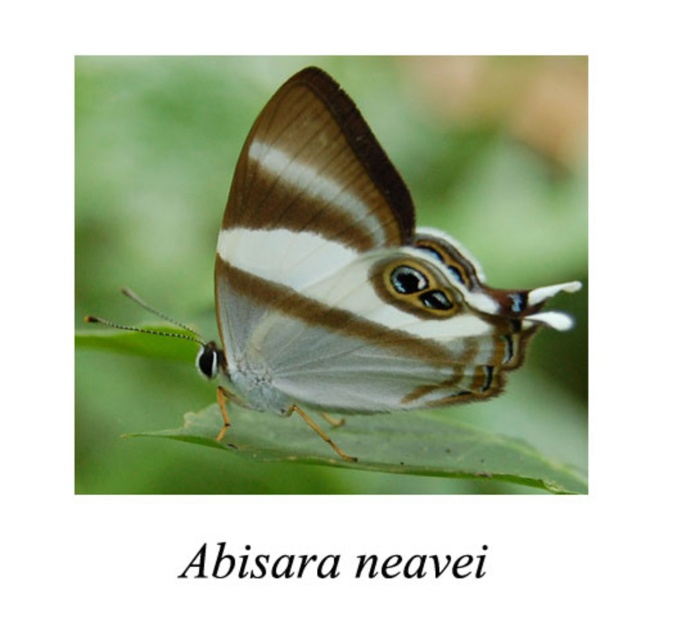
Question: Which point appears closest to the camera in this image?

Choices:
 (A) (584, 484)
 (B) (362, 234)

Answer: (B)

Question: Which point is farther to the camera?

Choices:
 (A) (449, 474)
 (B) (239, 179)

Answer: (B)

Question: Does matte brown butterfly at center appear on the right side of green matte leaf at center?

Choices:
 (A) no
 (B) yes

Answer: (A)

Question: Which of the following is the farthest from the observer?

Choices:
 (A) (250, 349)
 (B) (480, 461)

Answer: (B)

Question: Can you confirm if matte brown butterfly at center is smaller than green matte leaf at center?

Choices:
 (A) yes
 (B) no

Answer: (B)

Question: Can you confirm if matte brown butterfly at center is positioned to the right of green matte leaf at center?

Choices:
 (A) yes
 (B) no

Answer: (B)